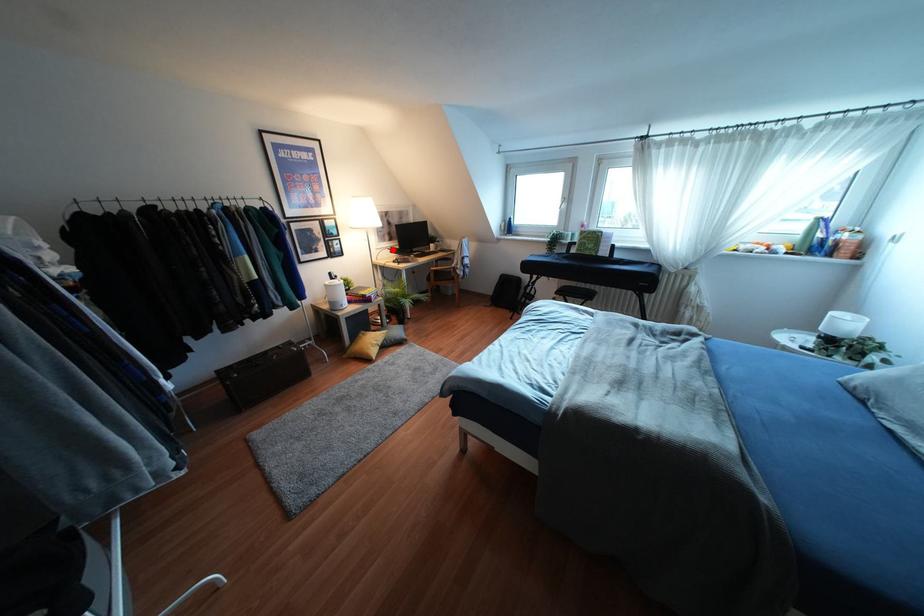
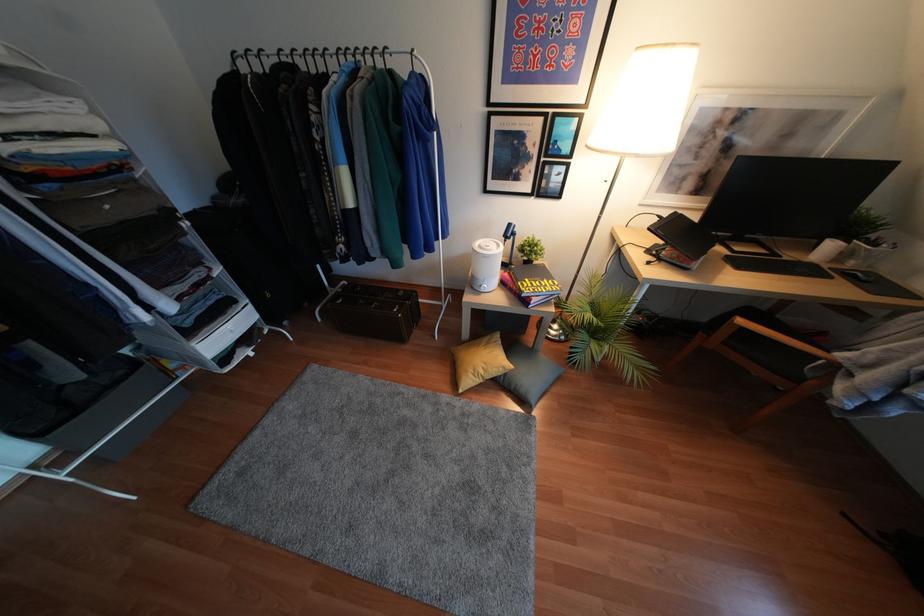
Question: I am providing you with two images of the same scene from different viewpoints. Given a red point in image1, look at the same physical point in image2. Is it:

Choices:
 (A) Closer to the viewpoint
 (B) Farther from the viewpoint

Answer: (B)